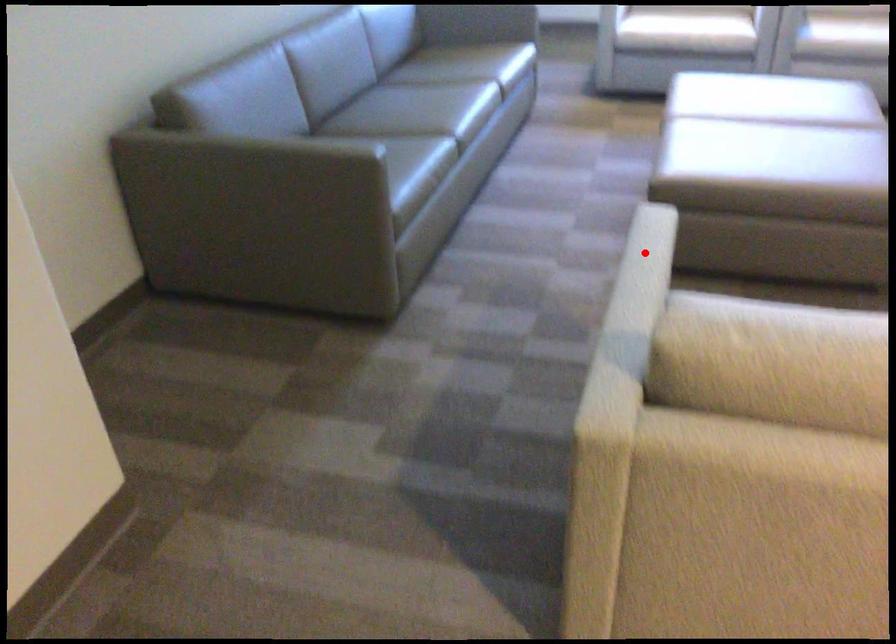
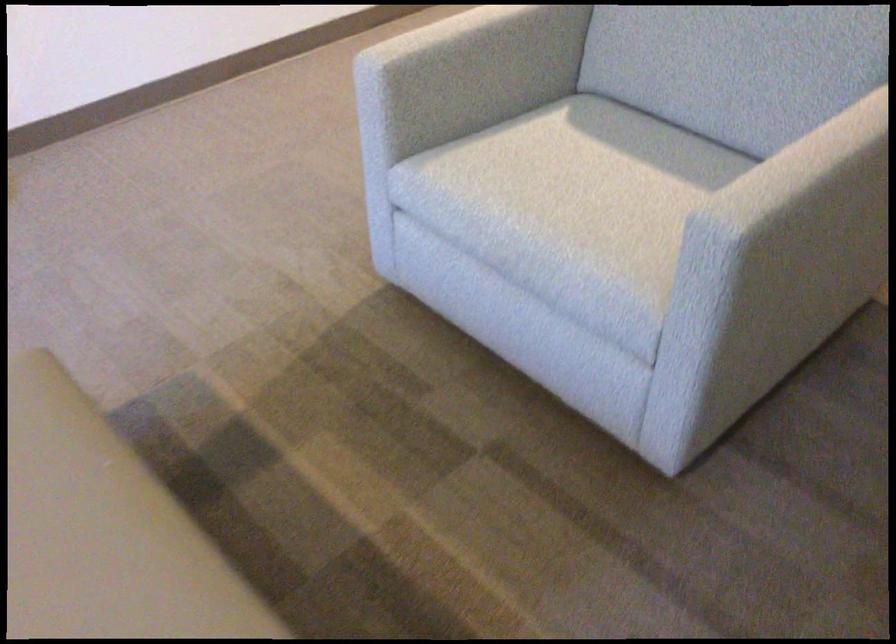
The point at the highlighted location is marked in the first image. Where is the corresponding point in the second image?

(780, 178)